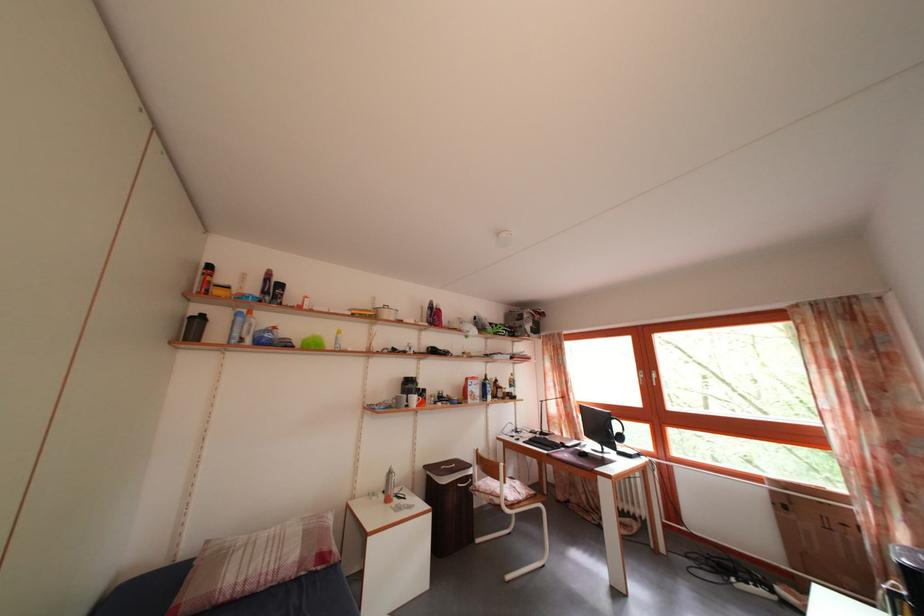
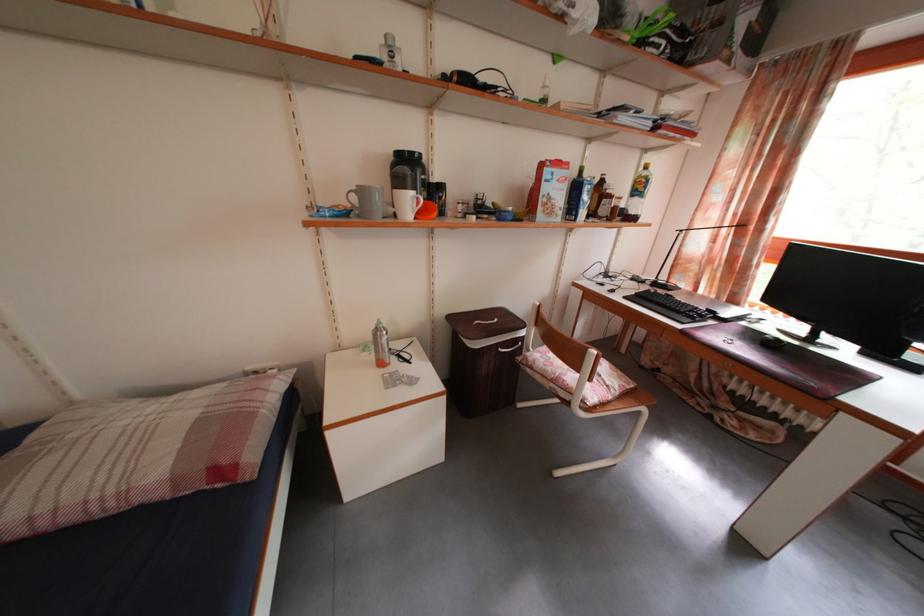
Find the pixel in the second image that matches point 402,408 in the first image.

(361, 206)